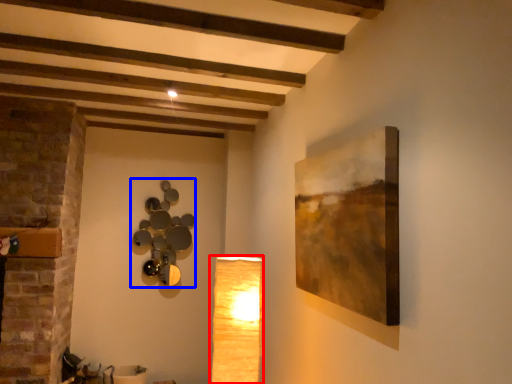
Question: Which object appears farthest to the camera in this image, lamp (highlighted by a red box) or lamp (highlighted by a blue box)?

Choices:
 (A) lamp
 (B) lamp

Answer: (B)